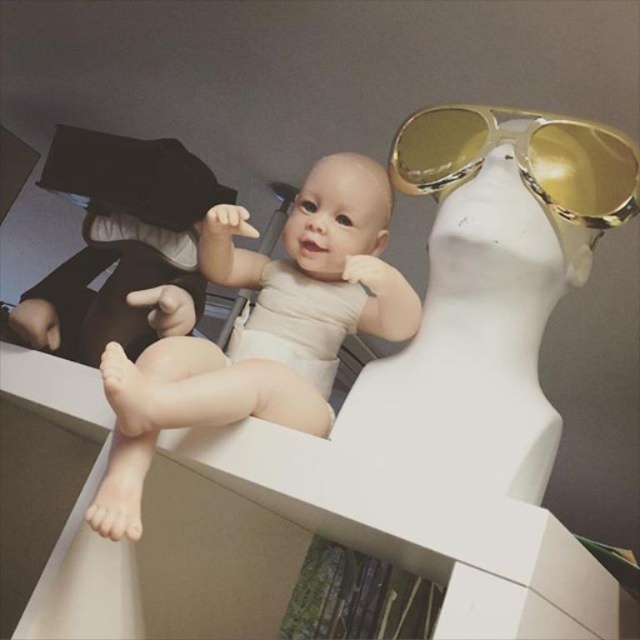
Who is more distant from viewer, (288,285) or (579,192)?

Point (288,285)

Is smooth beige baby at center positioned behind gold reflective sunglasses at upper right?

No, smooth beige baby at center is in front of gold reflective sunglasses at upper right.

Measure the distance between point (307, 195) and camera.

Point (307, 195) and camera are 31.00 inches apart.

You are a GUI agent. You are given a task and a screenshot of the screen. Output one action in this format:
    pyautogui.click(x=<x>, y=<y>)
    Task: Click on the smooth beige baby at center
    This screenshot has width=640, height=640.
    Given the screenshot: What is the action you would take?
    pyautogui.click(x=321, y=257)